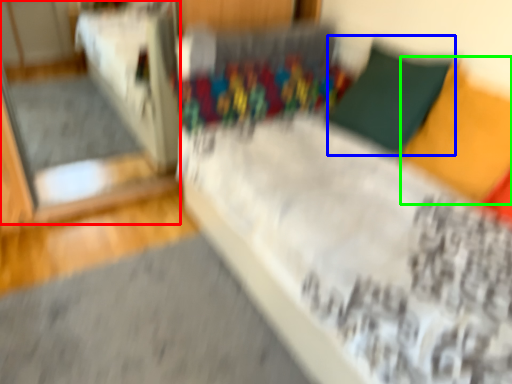
Question: Estimate the real-world distances between objects in this image. Which object is closer to glass door (highlighted by a red box), pillow (highlighted by a blue box) or pillow (highlighted by a green box)?

Choices:
 (A) pillow
 (B) pillow

Answer: (A)